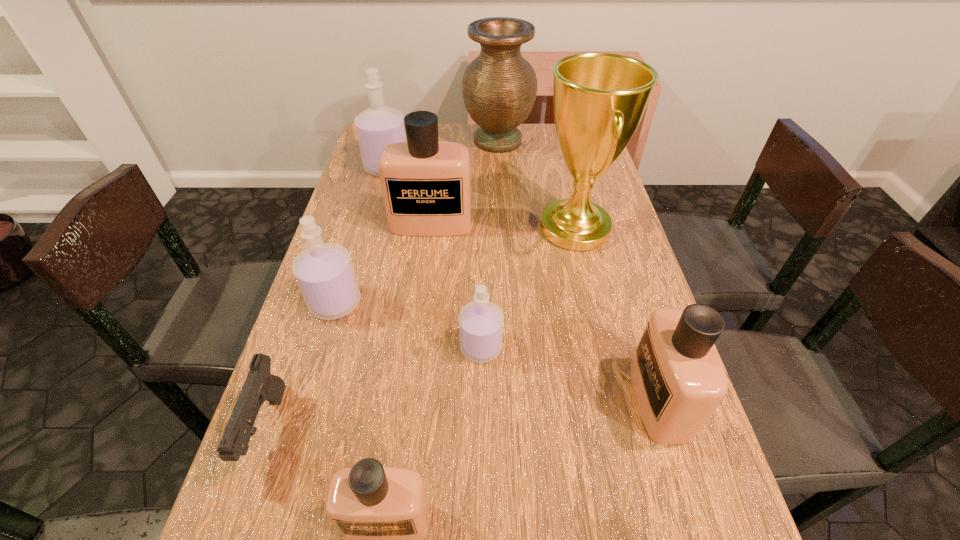
Where is `free space located on the front label of the rightmost beige perfume`? free space located on the front label of the rightmost beige perfume is located at coordinates (496, 400).

The height and width of the screenshot is (540, 960). In order to click on free point located 0.310m on the front label of the rightmost beige perfume in this screenshot , I will do `click(470, 400)`.

What are the coordinates of `vacant area located on the front label of the rightmost beige perfume` in the screenshot? It's located at (588, 400).

What are the coordinates of `vacant space located on the back of the nearest purple perfume` in the screenshot? It's located at coord(481,270).

What are the coordinates of `vase that is at the far edge` in the screenshot? It's located at (499, 87).

Where is `perfume that is at the far edge`? The width and height of the screenshot is (960, 540). perfume that is at the far edge is located at coordinates (379, 125).

This screenshot has width=960, height=540. Find the location of `pistol positioned at the left edge`. pistol positioned at the left edge is located at coordinates (260, 385).

At what (x,y) coordinates should I click in order to perform the action: click on award at the right edge. Please return your answer as a coordinate pair (x, y). The width and height of the screenshot is (960, 540). Looking at the image, I should click on (599, 99).

This screenshot has width=960, height=540. What are the coordinates of `perfume at the right edge` in the screenshot? It's located at click(x=678, y=378).

The height and width of the screenshot is (540, 960). I want to click on object present at the far left corner, so click(379, 125).